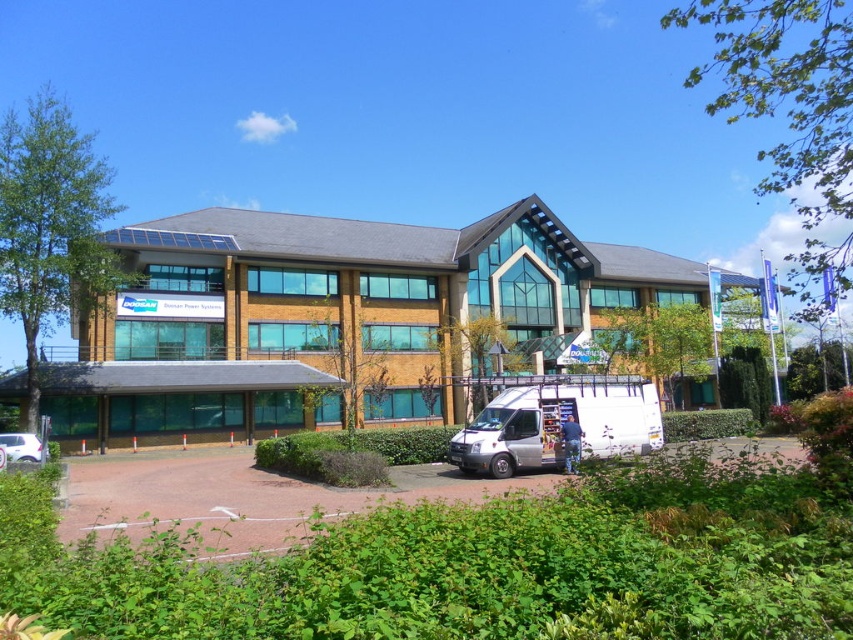
In the scene shown: You are standing at the point with coordinates point (608, 376) and want to walk to the point with coordinates point (386, 406). According to the scene, which direction should you move to reach your destination?

To reach point (386, 406) from point (608, 376), you should move upwards since point (386, 406) is behind point (608, 376).

You are a delivery driver who needs to park your white matte van at lower center in a spot that allows easy access to the green leafy park at lower center. Based on the scene, can you estimate if the van will fit without overlapping the park area?

The green leafy park at lower center is wider than the white matte van at lower center, so there is enough space for the van to park without overlapping the park area.

You are standing at the origin point of a coordinate system where the image spans from coordinates 0 to 1 in both x and y directions. You need to locate the matte brown building at center. What are its coordinates?

The coordinates of the matte brown building at center are at point (328,317).